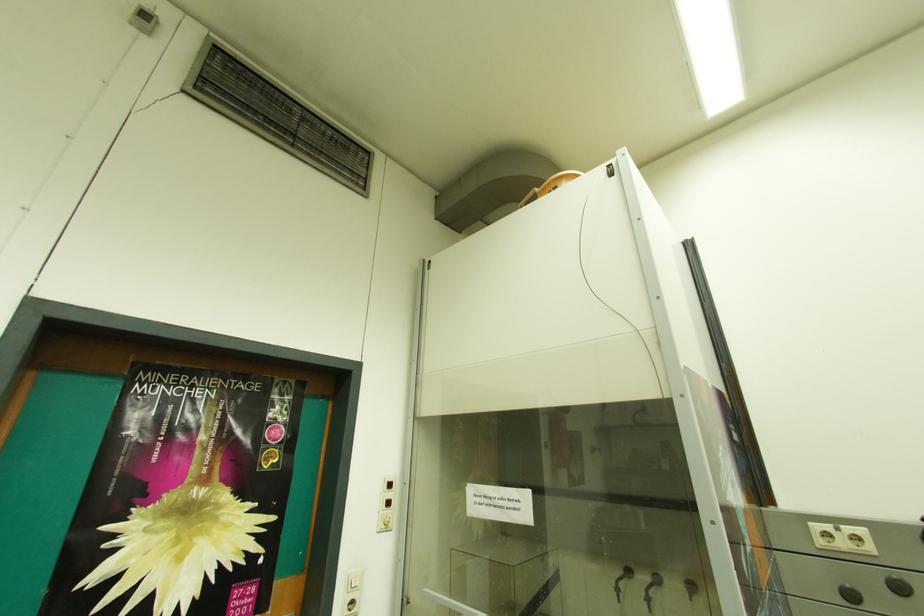
What do you see at coordinates (181, 498) in the screenshot? The height and width of the screenshot is (616, 924). I see `the fume hood sash` at bounding box center [181, 498].